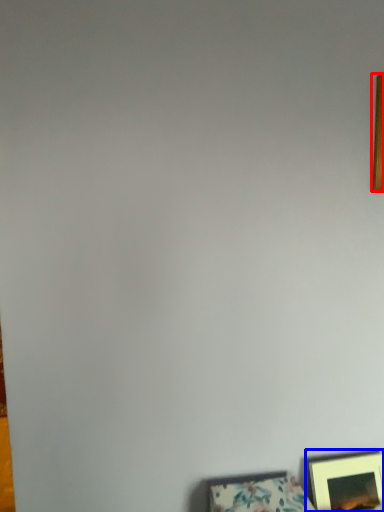
Question: Among these objects, which one is nearest to the camera, picture frame (highlighted by a red box) or picture frame (highlighted by a blue box)?

Choices:
 (A) picture frame
 (B) picture frame

Answer: (A)